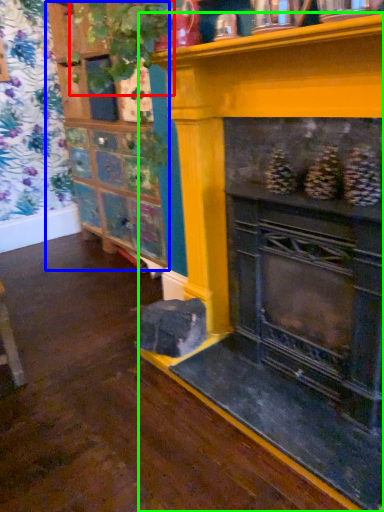
Question: Which object is positioned farthest from plant (highlighted by a red box)? Select from shelf (highlighted by a blue box) and fireplace (highlighted by a green box).

Choices:
 (A) shelf
 (B) fireplace

Answer: (A)